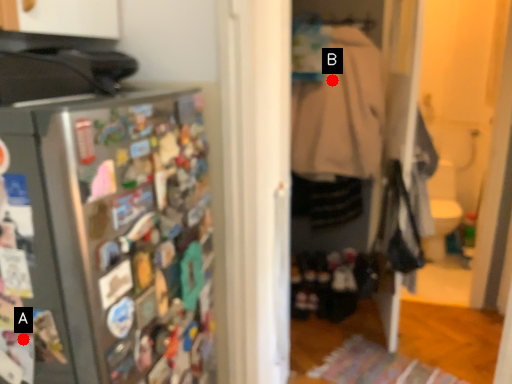
Question: Two points are circled on the image, labeled by A and B beside each circle. Which point appears farthest from the camera in this image?

Choices:
 (A) A is further
 (B) B is further

Answer: (B)